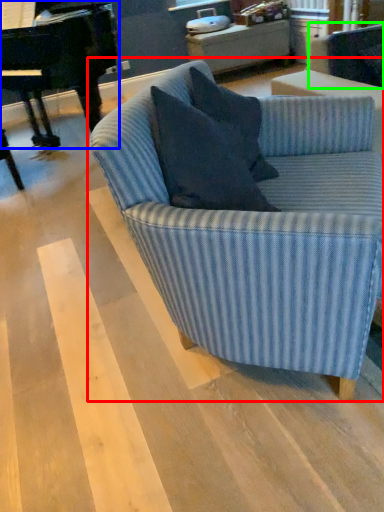
Question: Considering the real-world distances, which object is closest to studio couch (highlighted by a red box)? piano (highlighted by a blue box) or swivel chair (highlighted by a green box).

Choices:
 (A) piano
 (B) swivel chair

Answer: (B)